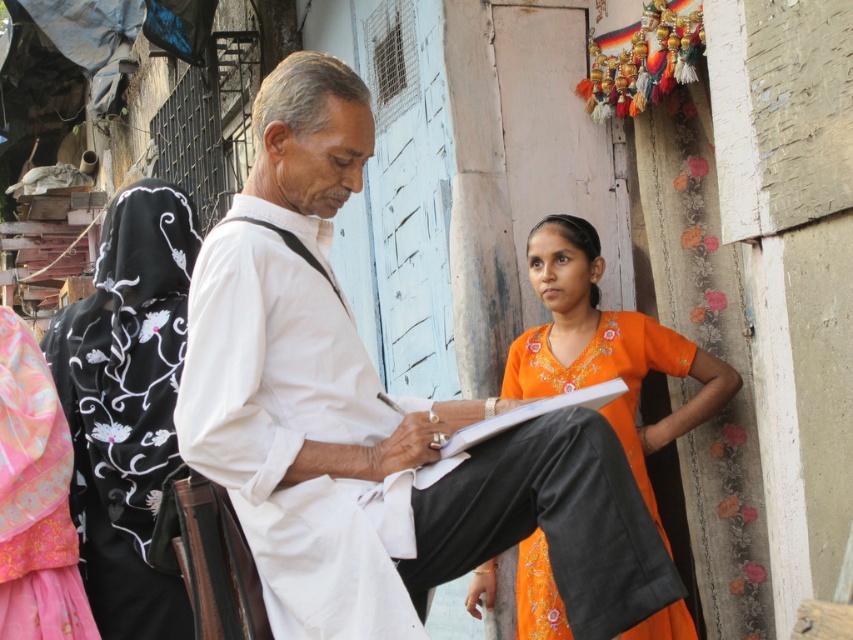
Can you confirm if orange embroidered dress at right is positioned to the left of white paper clipboard at center?

No, orange embroidered dress at right is not to the left of white paper clipboard at center.

Is orange embroidered dress at right above white paper clipboard at center?

Indeed, orange embroidered dress at right is positioned over white paper clipboard at center.

Does point (682, 344) come in front of point (474, 442)?

That is False.

I want to click on orange embroidered dress at right, so click(605, 348).

Does orange embroidered dress at right have a lesser height compared to pink satin dress at left?

In fact, orange embroidered dress at right may be taller than pink satin dress at left.

Is point (570, 227) closer to viewer compared to point (42, 580)?

That is False.

This screenshot has width=853, height=640. I want to click on orange embroidered dress at right, so click(605, 348).

Can you confirm if white cotton shirt at center is positioned to the right of black embroidered scarf at left?

Indeed, white cotton shirt at center is positioned on the right side of black embroidered scarf at left.

Based on the photo, who is lower down, white cotton shirt at center or black embroidered scarf at left?

white cotton shirt at center

Between point (282, 636) and point (136, 552), which one is positioned behind?

The point (136, 552) is behind.

Locate an element on the screen. Image resolution: width=853 pixels, height=640 pixels. white cotton shirt at center is located at coordinates (375, 419).